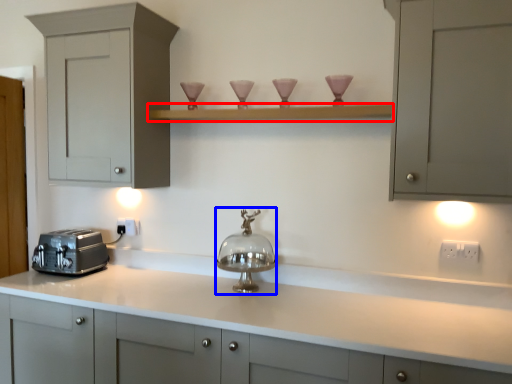
Question: Which point is further to the camera, shelf (highlighted by a red box) or appliance (highlighted by a blue box)?

Choices:
 (A) shelf
 (B) appliance

Answer: (B)